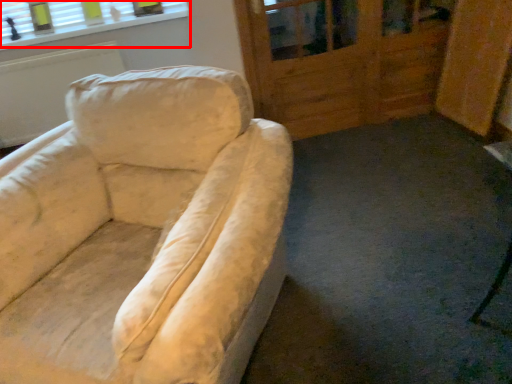
Question: Where is window (annotated by the red box) located in relation to screen door in the image?

Choices:
 (A) left
 (B) right

Answer: (A)